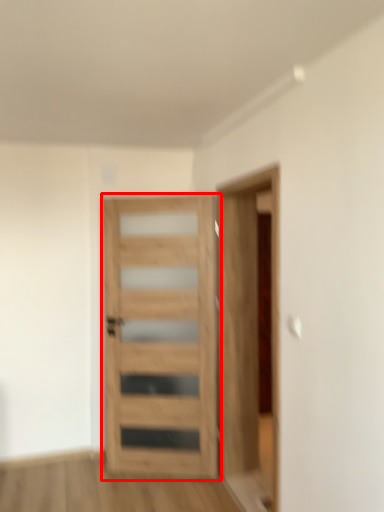
Question: From the image's perspective, considering the relative positions of door (annotated by the red box) and garage door in the image provided, where is door (annotated by the red box) located with respect to the staircase?

Choices:
 (A) above
 (B) below

Answer: (B)